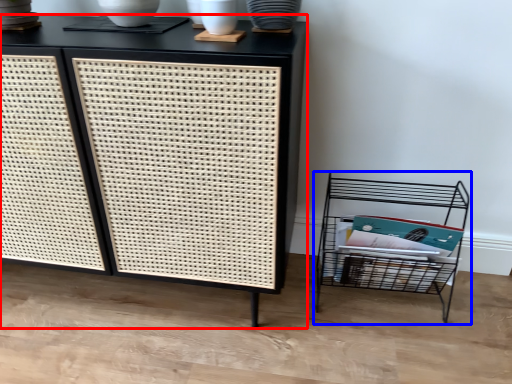
Question: Which of the following is the closest to the observer, furniture (highlighted by a red box) or shelf (highlighted by a blue box)?

Choices:
 (A) furniture
 (B) shelf

Answer: (A)